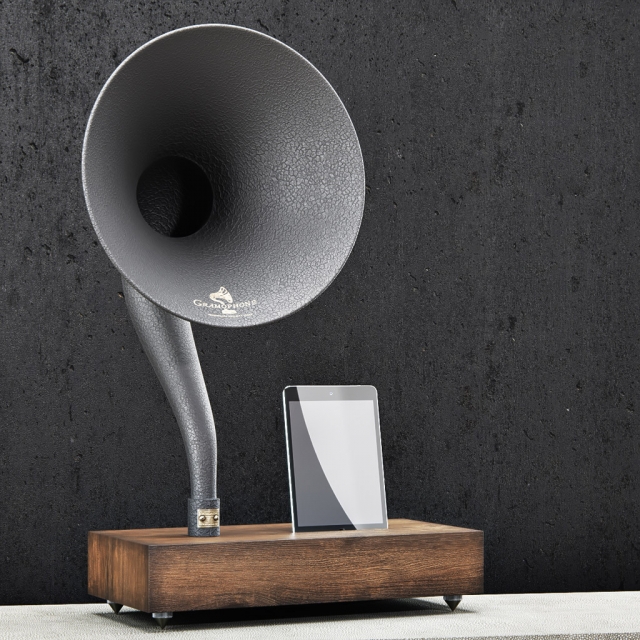
Image resolution: width=640 pixels, height=640 pixels. Identify the location of brown box. tap(177, 573).